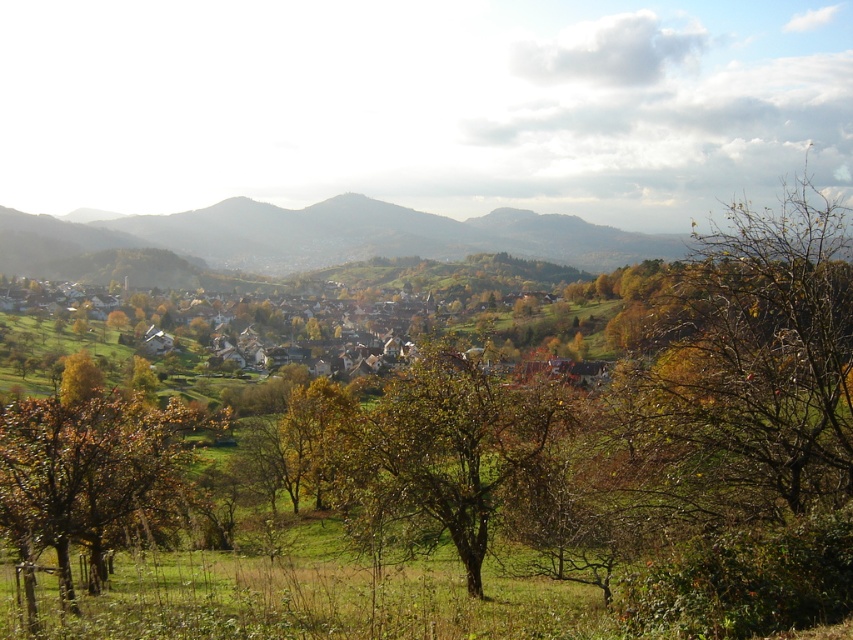
You are an artist planning to paint this rural autumn scene. You want to ensure that the green leafy tree at center and the brown leafy tree at lower left are proportionally accurate. Which tree should you make narrower in your painting?

The green leafy tree at center should be made narrower in the painting since it has a lesser width compared to the brown leafy tree at lower left according to the description.

You are standing at the point with coordinates point [230,253] and want to walk to the village in the midground. There is an obstacle at point [473,433]. Will you be able to see the obstacle from your current position?

Point [473,433] is in front of point [230,253], so yes, you can see the obstacle at point [473,433] from your current position at point [230,253] because it is located in front of you.

Looking at this image, you are standing at the point labeled as point (439, 456) in the image. Looking around, you see a green leafy tree at center. Can you tell me which direction the green leafy tree at center is relative to your current position?

The point (439, 456) is on the green leafy tree at center, so you are currently standing on the green leafy tree at center. Therefore, the green leafy tree at center is directly under your feet.